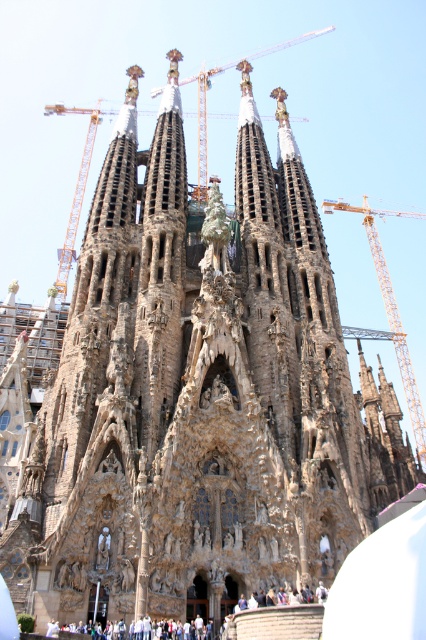
Question: Where is orange metallic crane at upper center located in relation to white cotton shirt at lower center in the image?

Choices:
 (A) above
 (B) below

Answer: (A)

Question: Which object is the farthest from the yellow metal crane at right?

Choices:
 (A) white cotton shirt at lower center
 (B) orange metallic crane at upper center

Answer: (A)

Question: In this image, where is orange metallic crane at upper center located relative to white cotton shirt at lower center?

Choices:
 (A) left
 (B) right

Answer: (A)

Question: Among these points, which one is nearest to the camera?

Choices:
 (A) (406, 212)
 (B) (88, 147)

Answer: (B)

Question: Does orange metallic crane at upper center appear over yellow metal crane at right?

Choices:
 (A) yes
 (B) no

Answer: (A)

Question: Which point is farther to the camera?

Choices:
 (A) white cotton shirt at lower center
 (B) orange metallic crane at upper center
 (C) yellow metal crane at right

Answer: (B)